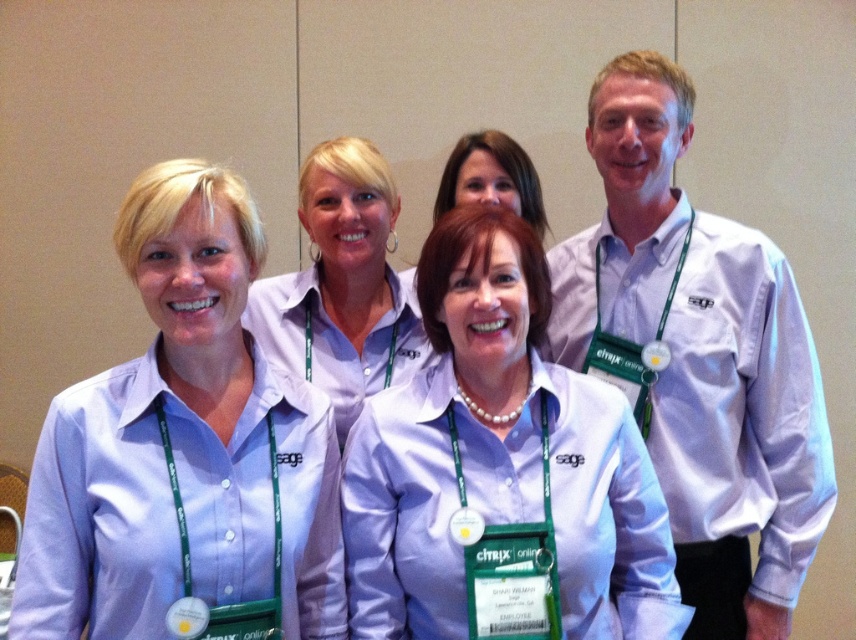
Does matte white shirt at center have a lesser width compared to pearl necklace at center?

Incorrect, matte white shirt at center's width is not less than pearl necklace at center's.

Who is lower down, matte white shirt at center or pearl necklace at center?

Positioned lower is matte white shirt at center.

The height and width of the screenshot is (640, 856). What are the coordinates of `matte white shirt at center` in the screenshot? It's located at (342, 284).

Can you confirm if matte purple shirt at center is positioned above pearl necklace at center?

No, matte purple shirt at center is not above pearl necklace at center.

Does point (470, 451) come behind point (453, 202)?

No, it is in front of (453, 202).

The width and height of the screenshot is (856, 640). I want to click on matte purple shirt at center, so 500,467.

Does matte purple shirt at left appear over white shirt at right?

Incorrect, matte purple shirt at left is not positioned above white shirt at right.

Between point (318, 608) and point (776, 545), which one is positioned in front?

Positioned in front is point (318, 608).

At what (x,y) coordinates should I click in order to perform the action: click on matte purple shirt at left. Please return your answer as a coordinate pair (x, y). This screenshot has width=856, height=640. Looking at the image, I should click on (185, 452).